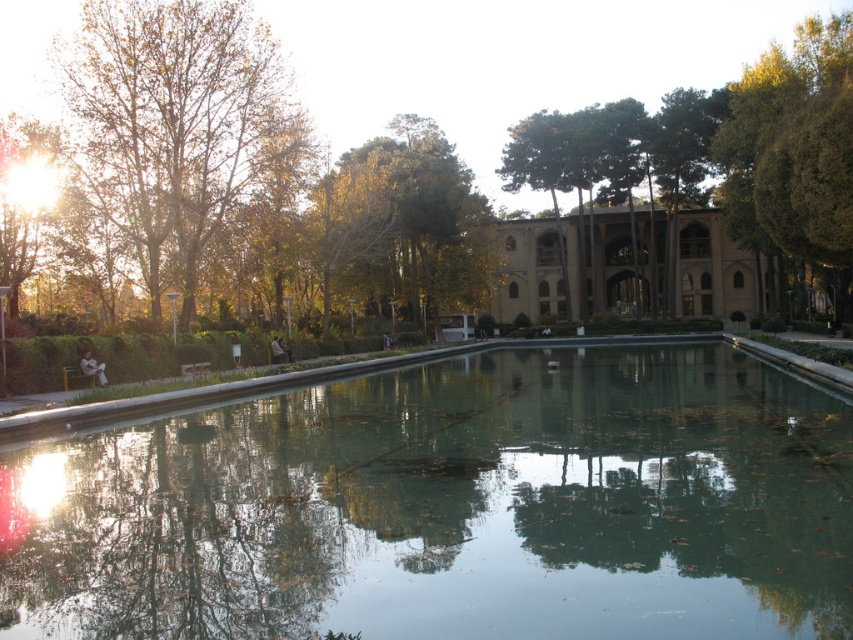
How much distance is there between green reflective water at center and brown leafy tree at left?

green reflective water at center and brown leafy tree at left are 24.03 meters apart.

Can you confirm if green reflective water at center is shorter than brown leafy tree at left?

Yes.

Between point (386, 458) and point (97, 3), which one is positioned behind?

Positioned behind is point (97, 3).

The height and width of the screenshot is (640, 853). Find the location of `green reflective water at center`. green reflective water at center is located at coordinates (451, 508).

Does brown leafy tree at left have a greater height compared to green leafy tree at center?

Yes.

Which is below, brown leafy tree at left or green leafy tree at center?

green leafy tree at center

At what (x,y) coordinates should I click in order to perform the action: click on brown leafy tree at left. Please return your answer as a coordinate pair (x, y). The width and height of the screenshot is (853, 640). Looking at the image, I should click on 178,124.

Where is `brown leafy tree at left`? The width and height of the screenshot is (853, 640). brown leafy tree at left is located at coordinates (178, 124).

Does point (337, 460) come closer to viewer compared to point (572, 300)?

Yes, point (337, 460) is closer to viewer.

Between green reflective water at center and beige stone palace at center, which one has less height?

With less height is green reflective water at center.

Where is `green reflective water at center`? green reflective water at center is located at coordinates click(451, 508).